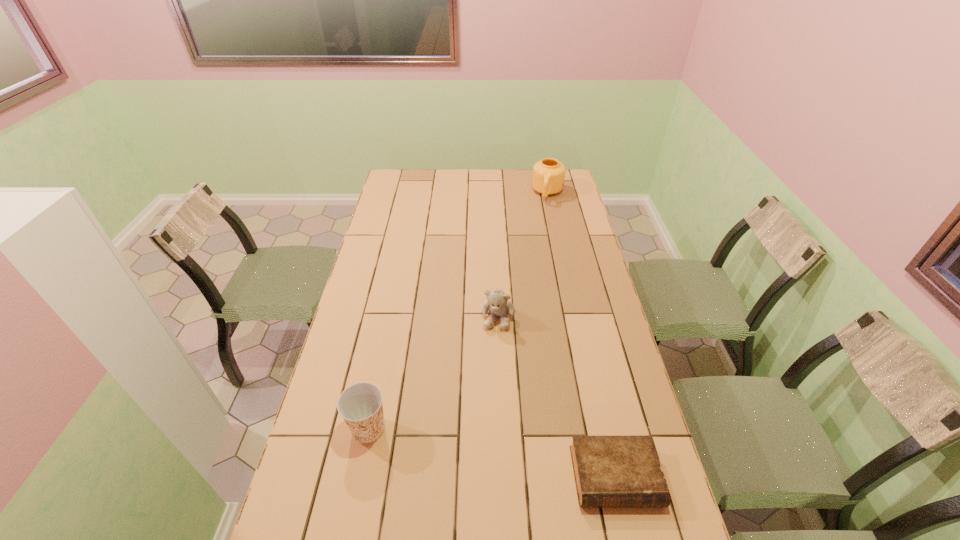
Identify the location of vacant space located 0.110m on the handle side of the farthest object. (543, 217).

I want to click on free point located 0.060m on the handle side of the farthest object, so pos(544,211).

I want to click on free space located 0.370m on the handle side of the farthest object, so click(536, 253).

Find the location of a particular element. object at the far edge is located at coordinates (548, 177).

I want to click on object that is at the near edge, so click(x=620, y=471).

In order to click on object that is at the left edge in this screenshot , I will do `click(360, 405)`.

At what (x,y) coordinates should I click in order to perform the action: click on diary that is at the right edge. Please return your answer as a coordinate pair (x, y). Looking at the image, I should click on (620, 471).

What are the coordinates of `mug located at the right edge` in the screenshot? It's located at (548, 177).

The height and width of the screenshot is (540, 960). What are the coordinates of `object that is at the far right corner` in the screenshot? It's located at [548, 177].

Image resolution: width=960 pixels, height=540 pixels. What are the coordinates of `object at the near right corner` in the screenshot? It's located at pyautogui.click(x=620, y=471).